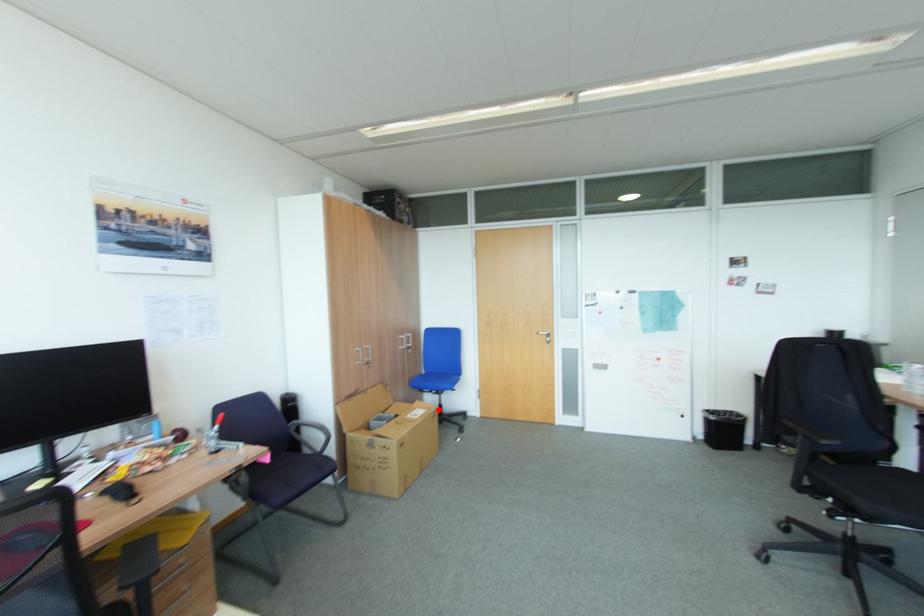
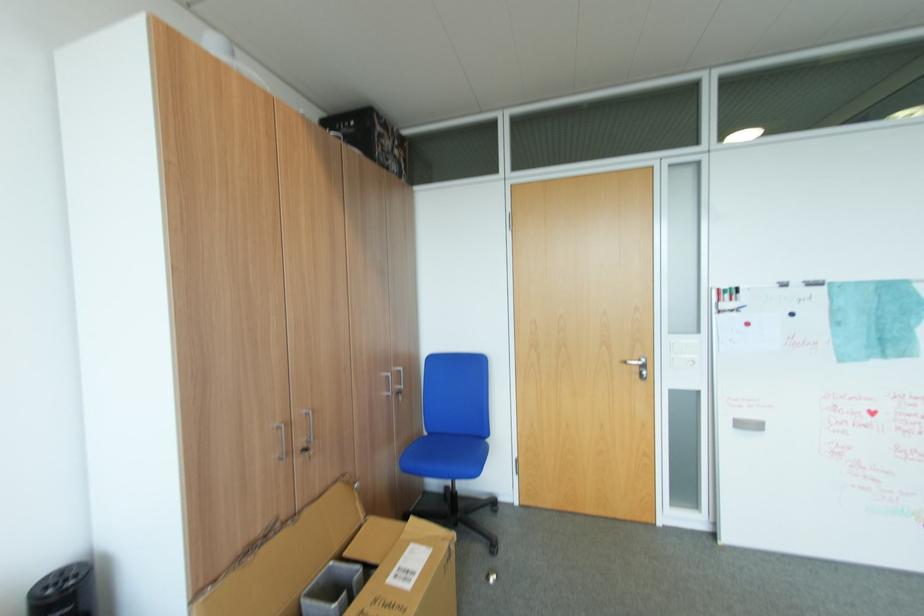
Question: I am providing you with two images of the same scene from different viewpoints. In image1, a red point is highlighted. Considering the same 3D point in image2, which of the following is correct?

Choices:
 (A) It is closer
 (B) It is farther

Answer: (A)